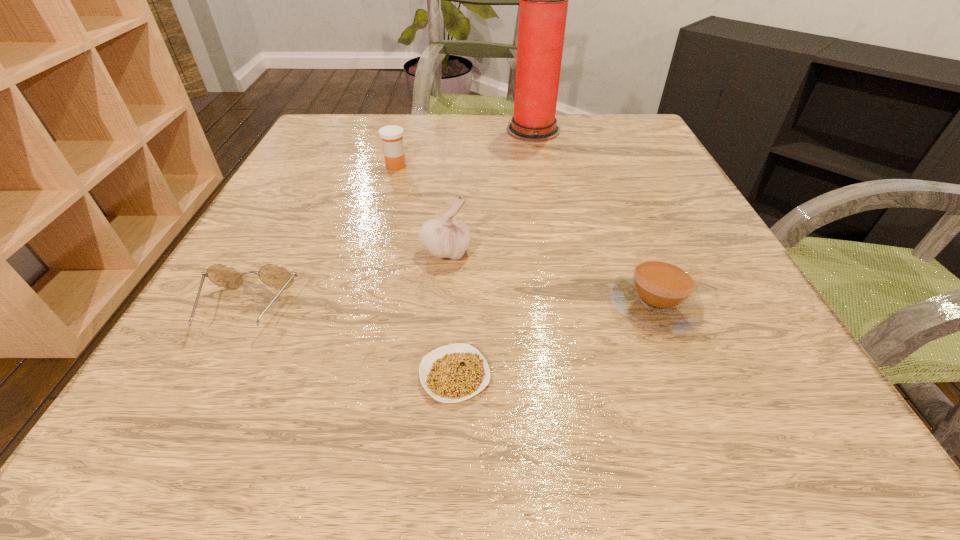
Identify the location of object located in the near edge section of the desktop. (453, 373).

You are a GUI agent. You are given a task and a screenshot of the screen. Output one action in this format:
    pyautogui.click(x=<x>, y=<y>)
    Task: Click on the object present at the left edge
    Image resolution: width=960 pixels, height=540 pixels.
    Given the screenshot: What is the action you would take?
    pyautogui.click(x=275, y=276)

Identify the location of object located at the right edge. The width and height of the screenshot is (960, 540). (659, 295).

The image size is (960, 540). In the image, there is a desktop. In order to click on free region at the far edge in this screenshot , I will do `click(440, 118)`.

In the image, there is a desktop. Identify the location of vacant space at the near edge. (471, 403).

This screenshot has height=540, width=960. I want to click on vacant space at the left edge of the desktop, so click(225, 307).

Find the location of `free space at the right edge of the desktop`. free space at the right edge of the desktop is located at coordinates (663, 176).

You are a GUI agent. You are given a task and a screenshot of the screen. Output one action in this format:
    pyautogui.click(x=<x>, y=<y>)
    Task: Click on the vacant area at the far left corner
    
    Given the screenshot: What is the action you would take?
    pyautogui.click(x=333, y=138)

In order to click on free point at the far right corner in this screenshot , I will do `click(647, 142)`.

Find the location of a particular element. free region at the near right corner of the desktop is located at coordinates (730, 411).